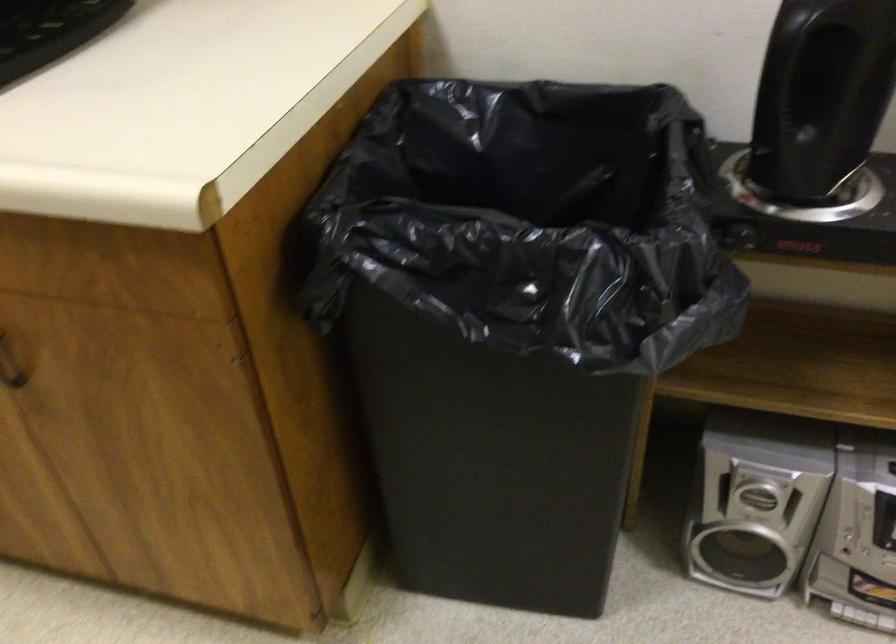
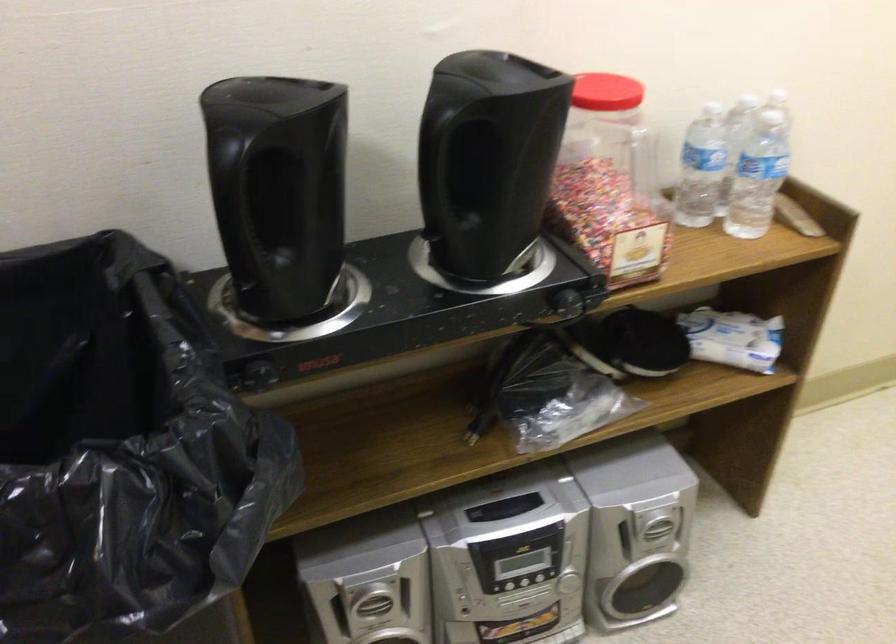
Where in the second image is the point corresponding to [716,305] from the first image?

(274, 480)